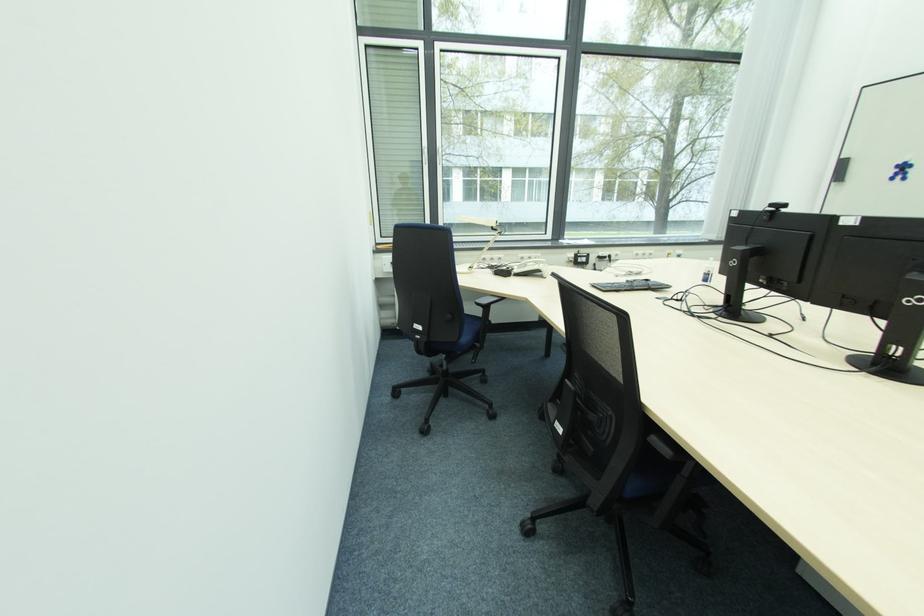
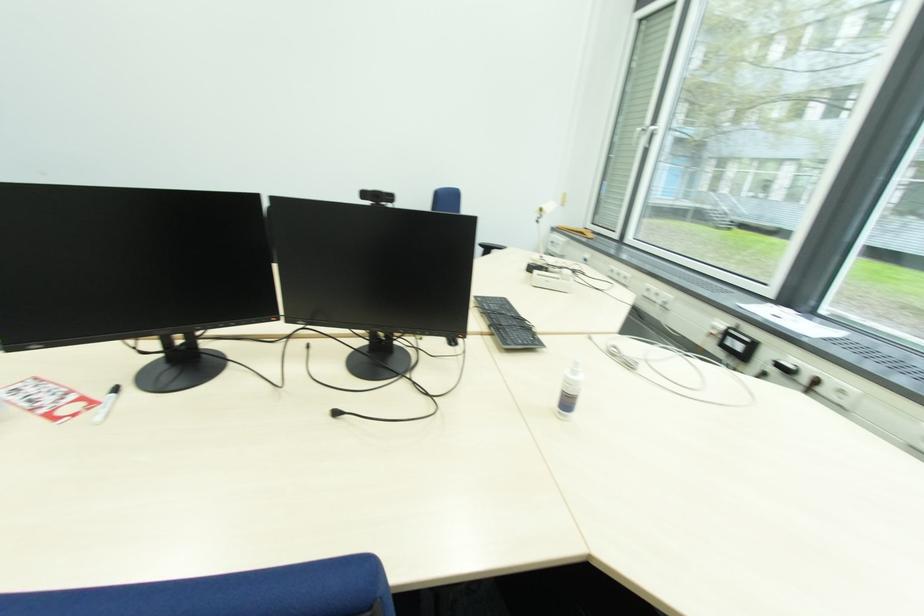
Find the pixel in the second image that matches (582,257) in the first image.

(734, 333)